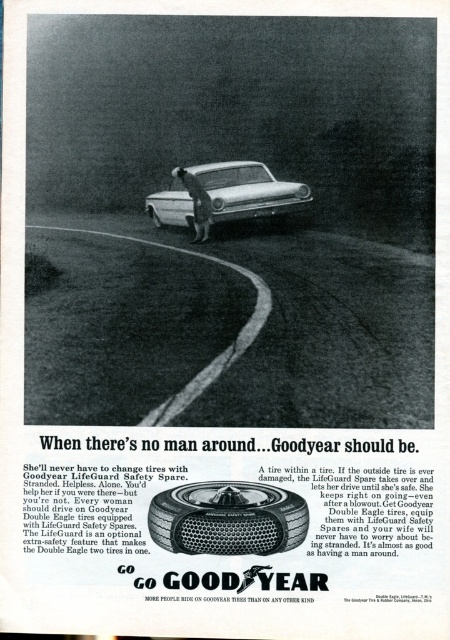
Question: Which of the following is the closest to the observer?

Choices:
 (A) (85, 291)
 (B) (241, 534)

Answer: (B)

Question: Observing the image, what is the correct spatial positioning of dirt track at center in reference to black rubber tire at center?

Choices:
 (A) above
 (B) below

Answer: (A)

Question: Does silver metallic sedan at center have a smaller size compared to matte rubber tire at center?

Choices:
 (A) yes
 (B) no

Answer: (B)

Question: Can you confirm if silver metallic sedan at center is smaller than matte rubber tire at center?

Choices:
 (A) yes
 (B) no

Answer: (B)

Question: Among these points, which one is farthest from the camera?

Choices:
 (A) (153, 211)
 (B) (255, 508)
 (C) (206, 180)

Answer: (A)

Question: Which object is farther from the camera taking this photo?

Choices:
 (A) silver metallic sedan at center
 (B) black rubber tire at center

Answer: (A)